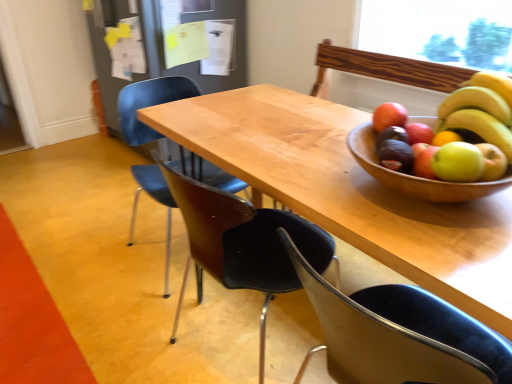
Where is `free space in front of matte black chair at center, positioned as the third chair in front-to-back order`? This screenshot has width=512, height=384. free space in front of matte black chair at center, positioned as the third chair in front-to-back order is located at coordinates pos(123,329).